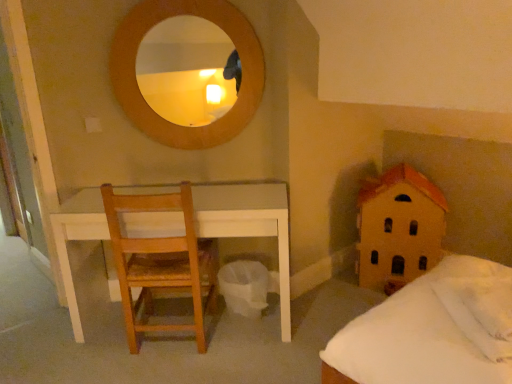
Where is `free space in front of light brown wooden chair at left`? The height and width of the screenshot is (384, 512). free space in front of light brown wooden chair at left is located at coordinates (166, 372).